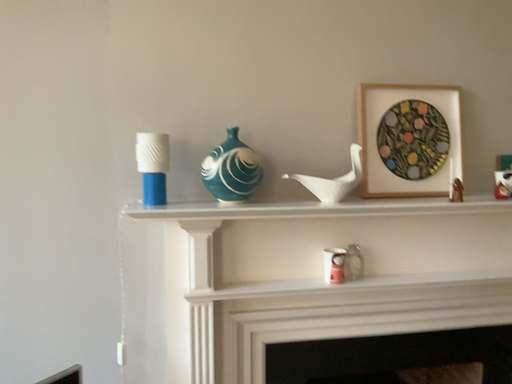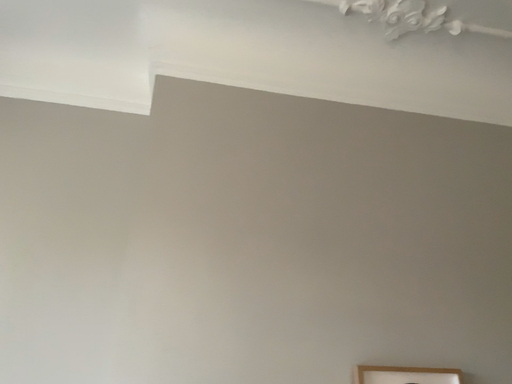
Question: How did the camera likely rotate when shooting the video?

Choices:
 (A) rotated upward
 (B) rotated downward

Answer: (A)